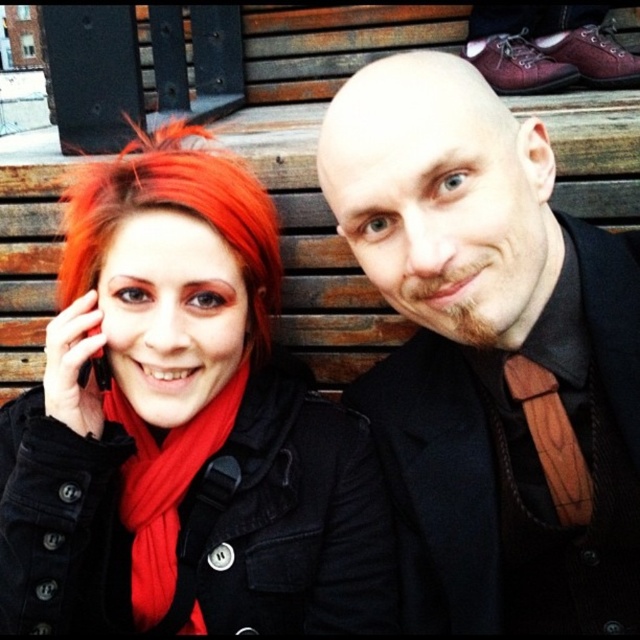
Is matte black coat at left positioned before shiny red hair at left?

No, matte black coat at left is behind shiny red hair at left.

Does point (141, 566) lie in front of point (225, 237)?

No, (141, 566) is further to viewer.

Locate an element on the screen. This screenshot has height=640, width=640. matte black coat at left is located at coordinates (182, 428).

Is point (321, 515) positioned behind point (148, 477)?

Yes, point (321, 515) is behind point (148, 477).

Does matte black coat at left have a smaller size compared to red soft scarf at left?

No.

Where is `matte black coat at left`? This screenshot has width=640, height=640. matte black coat at left is located at coordinates (182, 428).

Image resolution: width=640 pixels, height=640 pixels. Identify the location of matte black coat at left. (182, 428).

Which is in front, point (428, 342) or point (145, 612)?

Point (145, 612) is more forward.

Is matte black jacket at center in front of red soft scarf at left?

That is True.

The image size is (640, 640). What are the coordinates of `matte black jacket at center` in the screenshot? It's located at (492, 355).